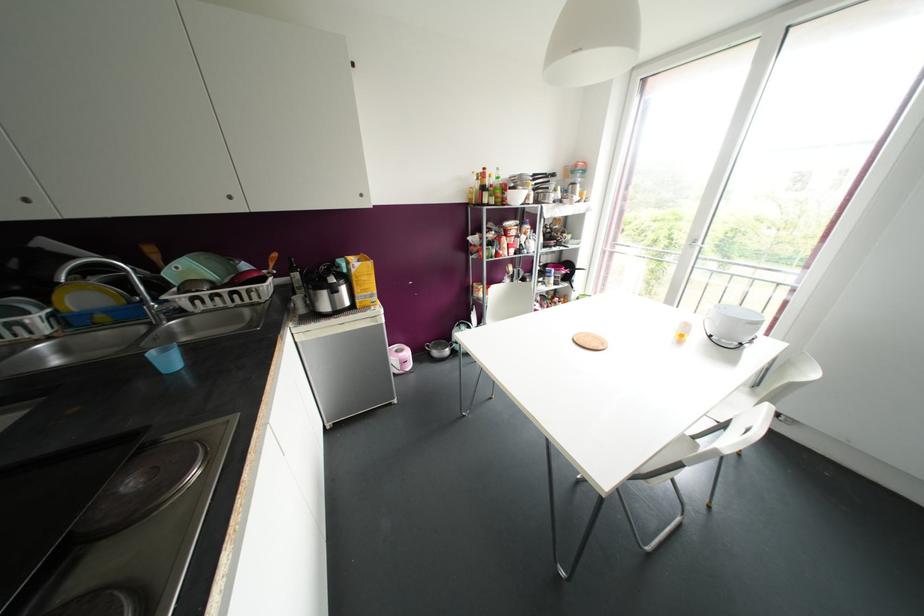
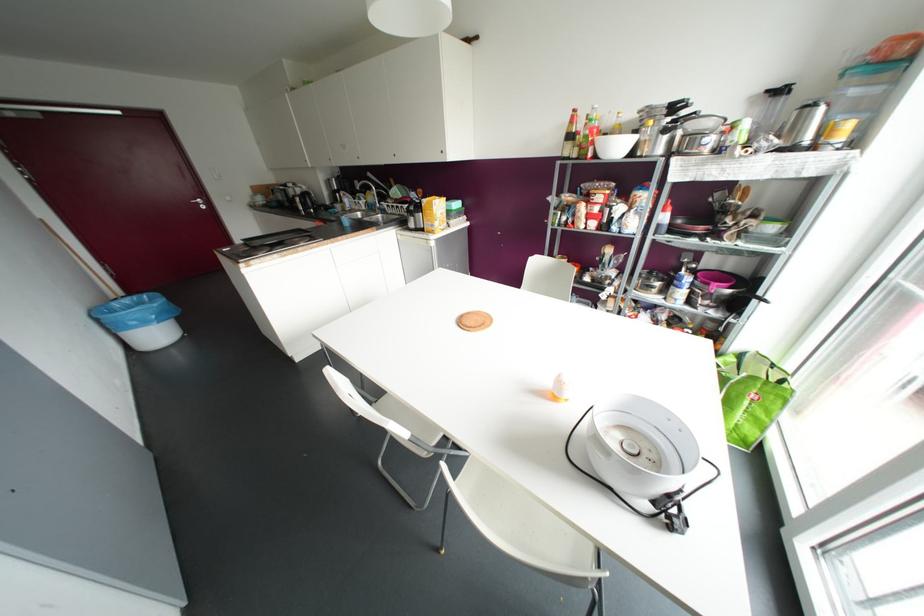
Locate, in the second image, the point that corresponds to (x=351, y=270) in the first image.

(421, 204)